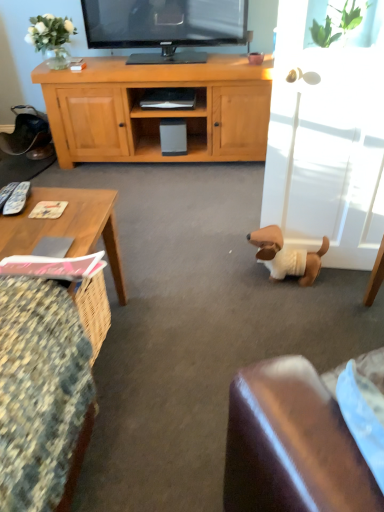
Find the location of a particular element. This screenshot has height=512, width=384. vacant space that is in between white glossy glass door at right and white plush dog at lower right is located at coordinates (341, 280).